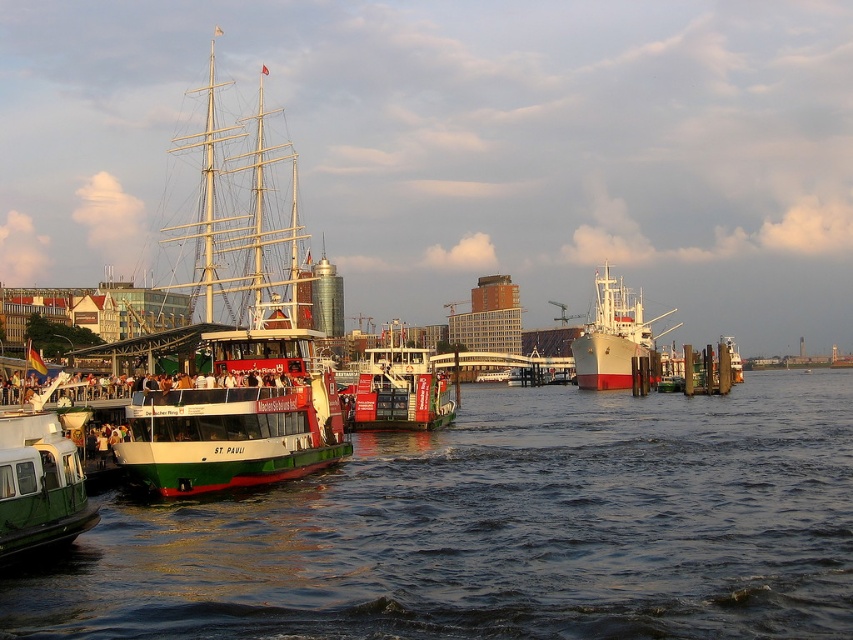
Can you confirm if dark blue water at center is positioned above red painted ferry at center?

Actually, dark blue water at center is below red painted ferry at center.

Which is behind, point (103, 560) or point (369, 387)?

Point (369, 387)

At what (x,y) coordinates should I click in order to perform the action: click on dark blue water at center. Please return your answer as a coordinate pair (x, y). The width and height of the screenshot is (853, 640). Looking at the image, I should click on (498, 529).

Image resolution: width=853 pixels, height=640 pixels. What do you see at coordinates (498, 529) in the screenshot?
I see `dark blue water at center` at bounding box center [498, 529].

Between dark blue water at center and green matte barge at lower left, which one has less height?

dark blue water at center is shorter.

Measure the distance between point (828, 413) and camera.

The distance of point (828, 413) from camera is 475.87 feet.

Locate an element on the screen. This screenshot has width=853, height=640. dark blue water at center is located at coordinates (498, 529).

From the picture: Measure the distance between green matte ship at left and green matte barge at lower left.

green matte ship at left is 178.58 feet from green matte barge at lower left.

Is green matte ship at left to the right of green matte barge at lower left from the viewer's perspective?

No, green matte ship at left is not to the right of green matte barge at lower left.

Between point (286, 252) and point (26, 520), which one is positioned behind?

The point (286, 252) is behind.

You are a GUI agent. You are given a task and a screenshot of the screen. Output one action in this format:
    pyautogui.click(x=<x>, y=<y>)
    Task: Click on the green matte ship at left
    Image resolution: width=853 pixels, height=640 pixels.
    Given the screenshot: What is the action you would take?
    pyautogui.click(x=239, y=342)